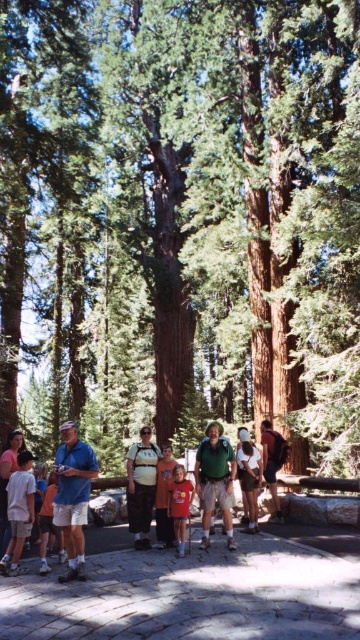
What do you see at coordinates (141, 486) in the screenshot? I see `camouflage pants at center` at bounding box center [141, 486].

Does point (132, 464) come closer to viewer compared to point (182, 516)?

That is False.

Which is behind, point (135, 534) or point (176, 484)?

Positioned behind is point (135, 534).

In order to click on camouflage pants at center in this screenshot , I will do `click(141, 486)`.

Is blue cotton shirt at center taller than dark brown leather backpack at center?

Indeed, blue cotton shirt at center has a greater height compared to dark brown leather backpack at center.

Where is `blue cotton shirt at center`? Image resolution: width=360 pixels, height=640 pixels. blue cotton shirt at center is located at coordinates (73, 497).

Based on the photo, can you confirm if white cotton shirt at center is positioned to the right of dark brown leather backpack at center?

In fact, white cotton shirt at center is to the left of dark brown leather backpack at center.

Identify the location of white cotton shirt at center. (249, 476).